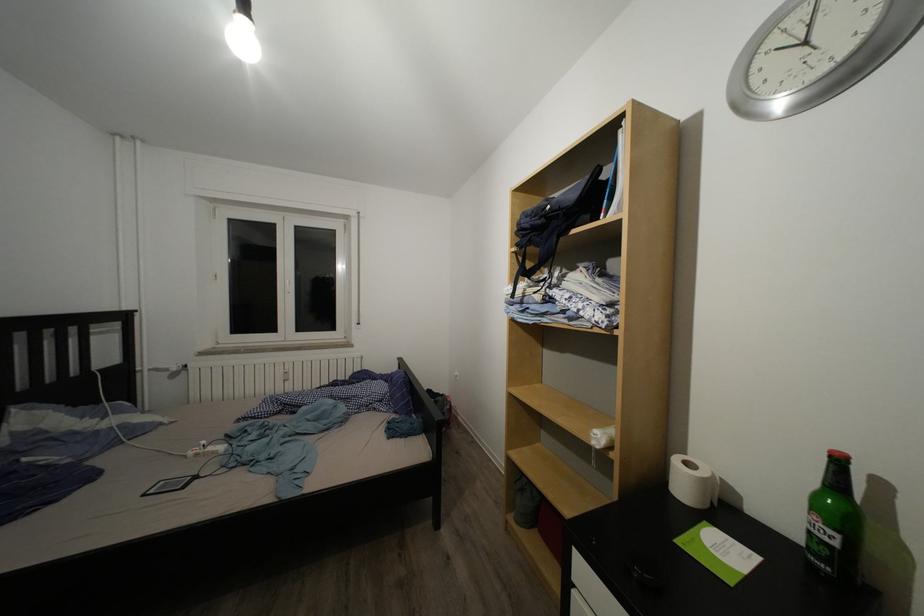
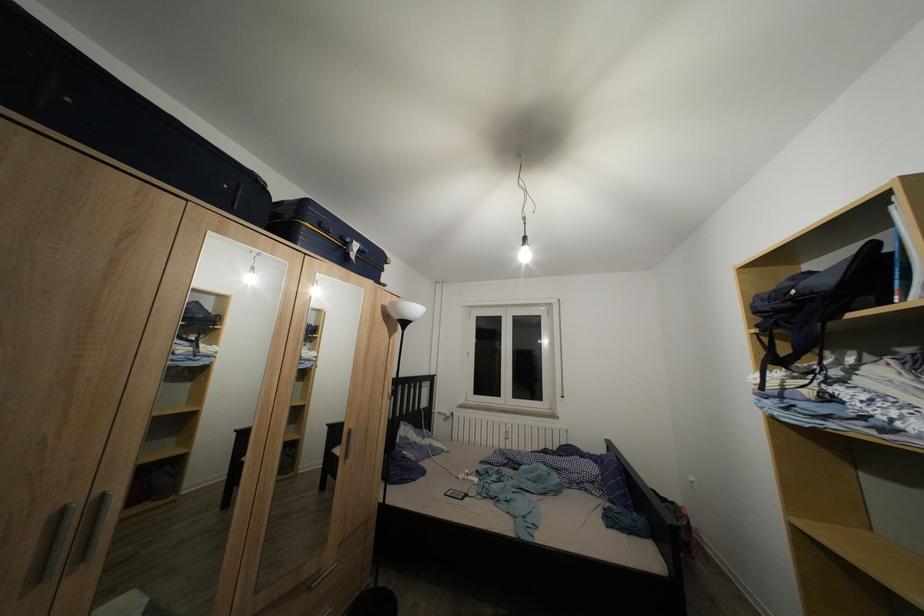
Question: Based on the continuous images, in which direction is the camera rotating? Reply with the corresponding letter.

Choices:
 (A) Left
 (B) Right
 (C) Up
 (D) Down

Answer: (A)